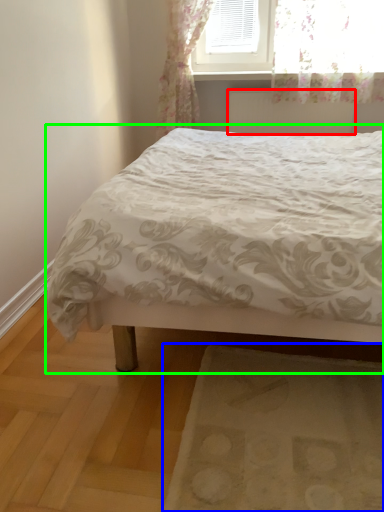
Question: Which object is positioned closest to radiator (highlighted by a red box)? Select from mat (highlighted by a blue box) and bed (highlighted by a green box).

Choices:
 (A) mat
 (B) bed

Answer: (B)